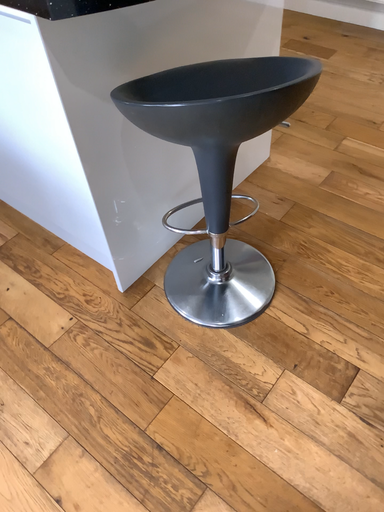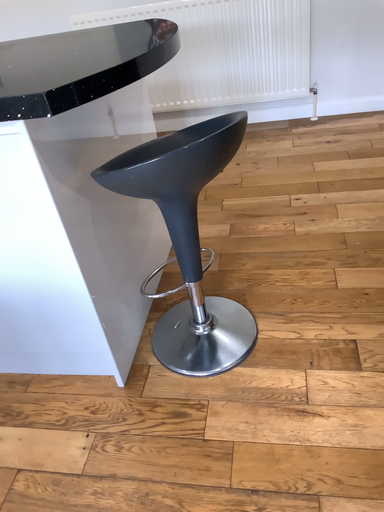
Question: Which way did the camera rotate in the video?

Choices:
 (A) rotated right
 (B) rotated left

Answer: (A)